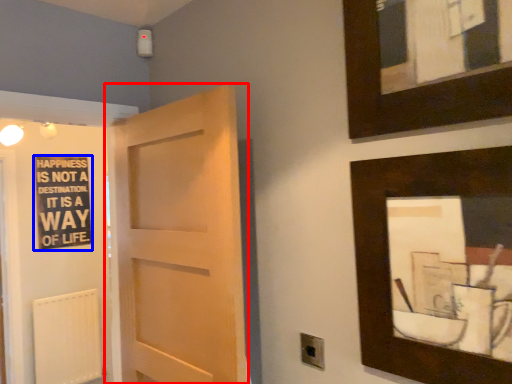
Question: Which point is further to the camera, door (highlighted by a red box) or bulletin board (highlighted by a blue box)?

Choices:
 (A) door
 (B) bulletin board

Answer: (B)